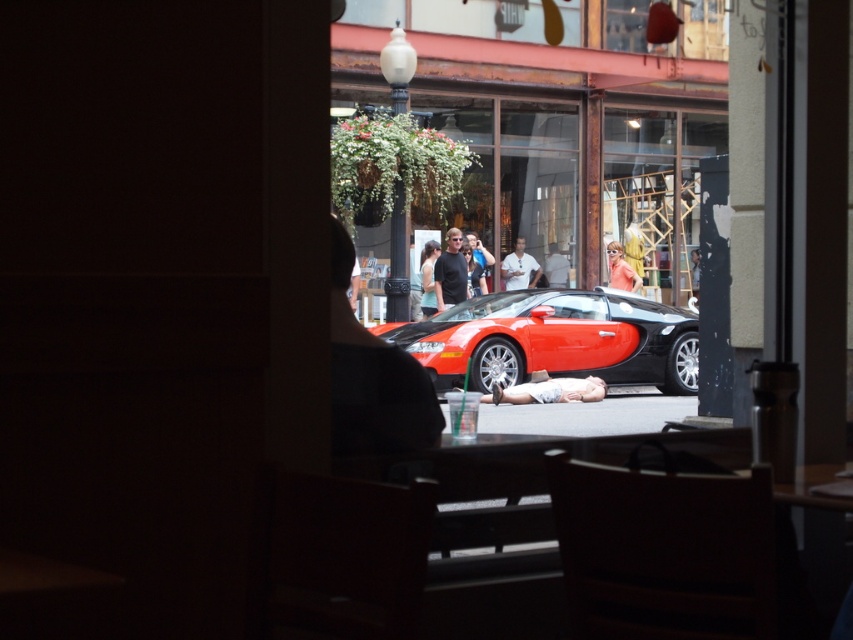
Question: Which of the following is the farthest from the observer?

Choices:
 (A) matte black car at center
 (B) matte black tank top at center
 (C) shiny red/black car at center

Answer: (A)

Question: Is matte black tank top at center positioned in front of orange fabric dress at center?

Choices:
 (A) yes
 (B) no

Answer: (A)

Question: Does shiny red/black car at center appear under matte black car at center?

Choices:
 (A) yes
 (B) no

Answer: (A)

Question: Is smooth white skin at center further to the viewer compared to orange fabric dress at center?

Choices:
 (A) yes
 (B) no

Answer: (B)

Question: Which object is the farthest from the orange fabric dress at center?

Choices:
 (A) matte black tank top at center
 (B) black textured shirt at center
 (C) shiny black car at center
 (D) shiny red/black car at center

Answer: (C)

Question: Among these points, which one is farthest from the camera?

Choices:
 (A) (375, 465)
 (B) (668, 328)

Answer: (B)